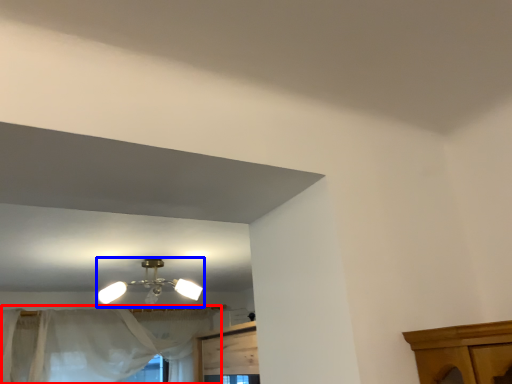
Question: Which point is closer to the camera, curtain (highlighted by a red box) or lamp (highlighted by a blue box)?

Choices:
 (A) curtain
 (B) lamp

Answer: (B)